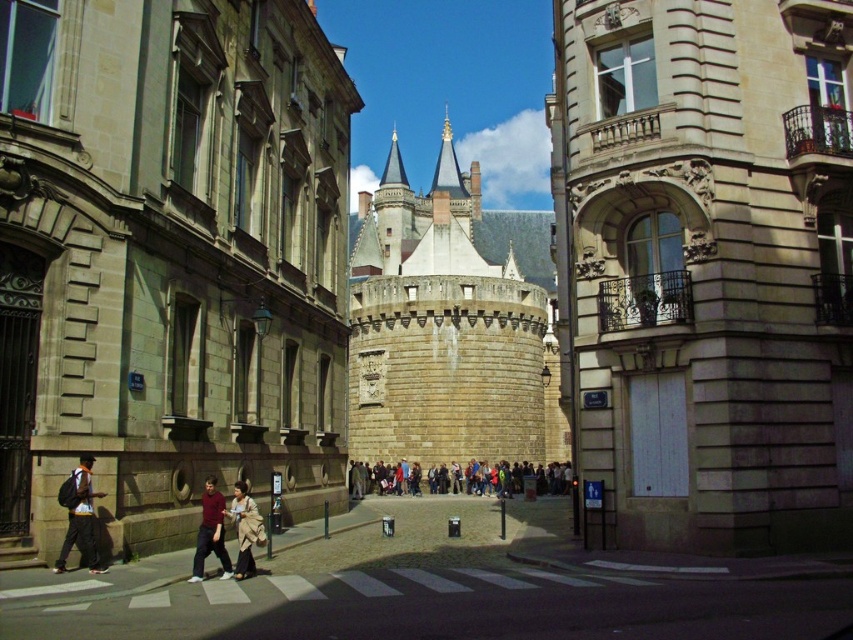
Is stone tower at center positioned before dark gray backpack at left?

No.

Is stone tower at center to the left of dark gray backpack at left from the viewer's perspective?

No, stone tower at center is not to the left of dark gray backpack at left.

At what (x,y) coordinates should I click in order to perform the action: click on stone tower at center. Please return your answer as a coordinate pair (x, y). Looking at the image, I should click on point(708,264).

In the scene shown: Which of these two, smooth stone castle at center or light brown leather jacket at center, stands taller?

smooth stone castle at center is taller.

Describe the element at coordinates (451, 323) in the screenshot. I see `smooth stone castle at center` at that location.

At what (x,y) coordinates should I click in order to perform the action: click on smooth stone castle at center. Please return your answer as a coordinate pair (x, y). Looking at the image, I should click on (451, 323).

Does stone castle at center appear on the right side of dark gray fabric jacket at center?

In fact, stone castle at center is to the left of dark gray fabric jacket at center.

Does stone castle at center have a larger size compared to dark gray fabric jacket at center?

Yes.

Where is `stone castle at center`? This screenshot has height=640, width=853. stone castle at center is located at coordinates (170, 260).